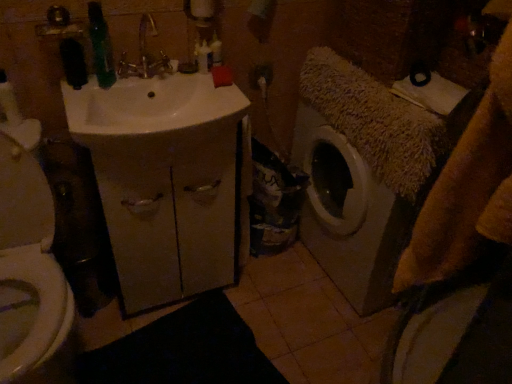
Question: Could you tell me if white glossy toilet at left is facing white plastic bottle at upper center, the 2th toiletry when ordered from right to left?

Choices:
 (A) yes
 (B) no

Answer: (B)

Question: Does white glossy toilet at left contain white plastic bottle at upper center, the 2th toiletry when ordered from right to left?

Choices:
 (A) yes
 (B) no

Answer: (B)

Question: Is white plastic bottle at upper center, which is counted as the first toiletry, starting from the left, at the back of white glossy toilet at left?

Choices:
 (A) no
 (B) yes

Answer: (A)

Question: Considering the relative sizes of white glossy toilet at left and white plastic bottle at upper center, which is counted as the first toiletry, starting from the left, in the image provided, is white glossy toilet at left wider than white plastic bottle at upper center, which is counted as the first toiletry, starting from the left,?

Choices:
 (A) yes
 (B) no

Answer: (A)

Question: From the image's perspective, is white glossy toilet at left located beneath white plastic bottle at upper center, which is counted as the first toiletry, starting from the left?

Choices:
 (A) yes
 (B) no

Answer: (A)

Question: From a real-world perspective, is white glossy toilet at left located higher than white plastic bottle at upper center, which is counted as the first toiletry, starting from the left?

Choices:
 (A) no
 (B) yes

Answer: (A)

Question: Can you confirm if white matte cabinet at center is thinner than white plastic bottle at upper center, the 2th toiletry when ordered from right to left?

Choices:
 (A) yes
 (B) no

Answer: (B)

Question: Does white matte cabinet at center lie behind white plastic bottle at upper center, the 2th toiletry when ordered from right to left?

Choices:
 (A) yes
 (B) no

Answer: (B)

Question: From the image's perspective, is white matte cabinet at center on top of white plastic bottle at upper center, which is counted as the first toiletry, starting from the left?

Choices:
 (A) yes
 (B) no

Answer: (B)

Question: From the image's perspective, would you say white matte cabinet at center is shown under white plastic bottle at upper center, the 2th toiletry when ordered from right to left?

Choices:
 (A) no
 (B) yes

Answer: (B)

Question: Can you confirm if white matte cabinet at center is bigger than white plastic bottle at upper center, the 2th toiletry when ordered from right to left?

Choices:
 (A) yes
 (B) no

Answer: (A)

Question: Is white matte cabinet at center looking in the opposite direction of white plastic bottle at upper center, the 2th toiletry when ordered from right to left?

Choices:
 (A) yes
 (B) no

Answer: (B)

Question: Does translucent plastic bottle at upper center, positioned as the 2th toiletry in left-to-right order, appear on the left side of white matte cabinet at center?

Choices:
 (A) yes
 (B) no

Answer: (B)